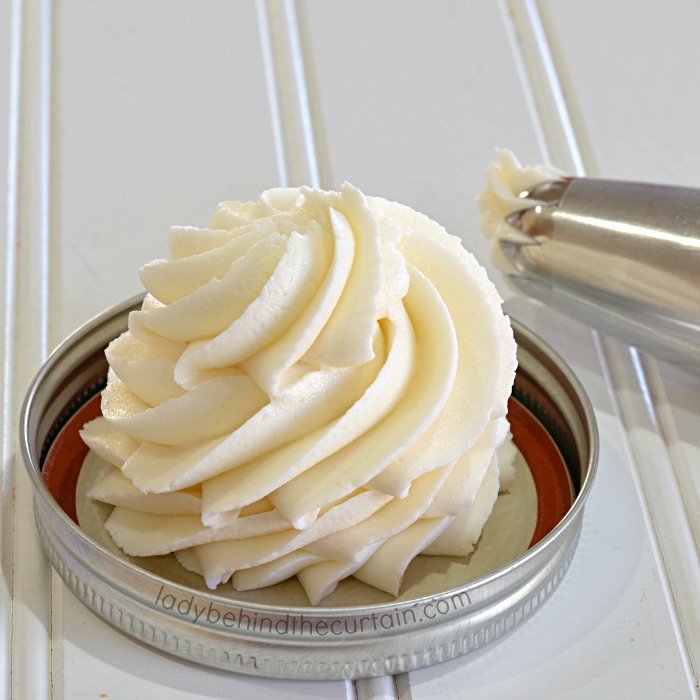
This screenshot has width=700, height=700. In order to click on dispenser in this screenshot , I will do `click(605, 272)`.